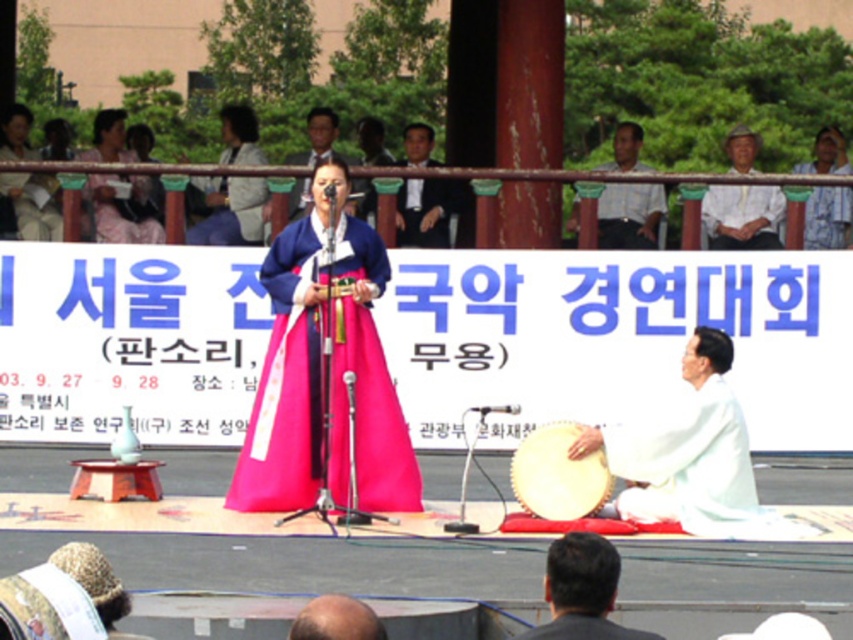
Question: Is pink satin hanbok at center thinner than bald head at center?

Choices:
 (A) no
 (B) yes

Answer: (A)

Question: Can you confirm if dark brown suit at lower center is positioned above white striped shirt at upper center?

Choices:
 (A) no
 (B) yes

Answer: (A)

Question: Considering the real-world distances, which object is farthest from the matte blue kimono at center?

Choices:
 (A) white silk robe at center
 (B) pink satin hanbok at center
 (C) white cotton shirt at upper right
 (D) white cotton hat at upper right

Answer: (A)

Question: Does white striped shirt at upper center appear on the left side of bald head at center?

Choices:
 (A) no
 (B) yes

Answer: (A)

Question: Among these points, which one is nearest to the camera?

Choices:
 (A) (96, 237)
 (B) (305, 224)
 (C) (299, 612)

Answer: (C)

Question: Which is farther from the white cloth drum at center?

Choices:
 (A) white cotton shirt at upper right
 (B) pink satin hanbok at center
 (C) matte pink dress at center

Answer: (C)